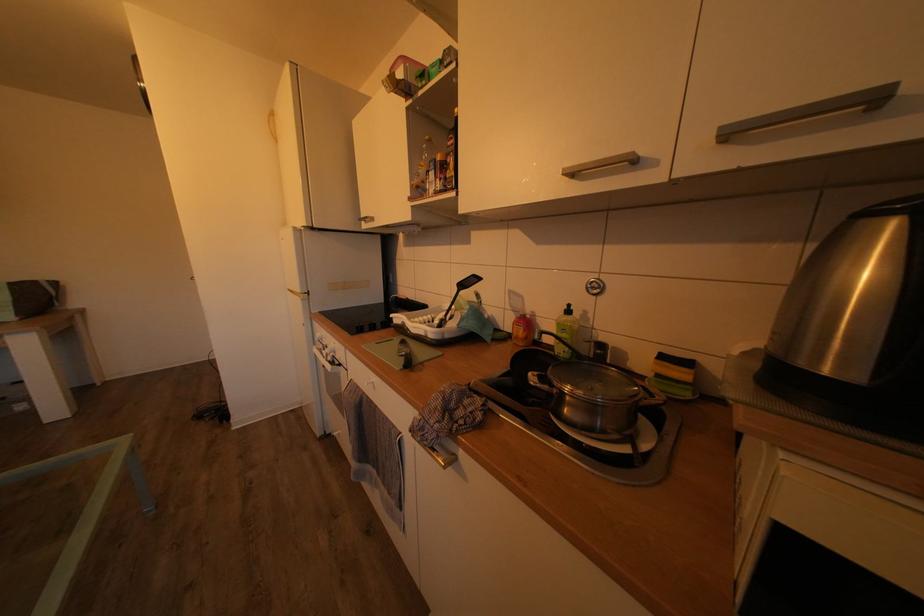
The width and height of the screenshot is (924, 616). Identify the location of pot lid handle. (592, 344).